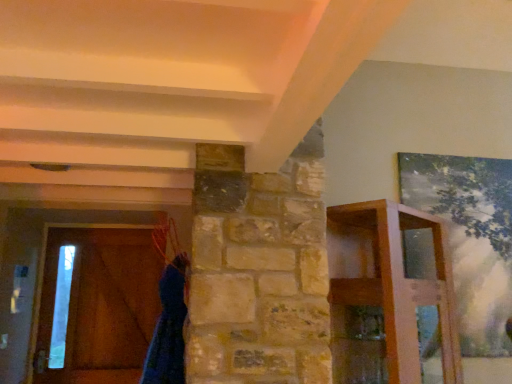
Question: Is wooden shelf at right positioned in front of brown wooden barn door at left?

Choices:
 (A) yes
 (B) no

Answer: (A)

Question: Considering the relative sizes of wooden shelf at right and brown wooden barn door at left in the image provided, is wooden shelf at right thinner than brown wooden barn door at left?

Choices:
 (A) no
 (B) yes

Answer: (A)

Question: Is wooden shelf at right further to the viewer compared to brown wooden barn door at left?

Choices:
 (A) yes
 (B) no

Answer: (B)

Question: Is wooden shelf at right far away from brown wooden barn door at left?

Choices:
 (A) no
 (B) yes

Answer: (B)

Question: Is wooden shelf at right facing away from brown wooden barn door at left?

Choices:
 (A) no
 (B) yes

Answer: (B)

Question: Is brown wooden barn door at left a part of wooden shelf at right?

Choices:
 (A) no
 (B) yes

Answer: (A)

Question: Is blue fuzzy robe at lower left shorter than brown wooden barn door at left?

Choices:
 (A) yes
 (B) no

Answer: (A)

Question: Is blue fuzzy robe at lower left positioned before brown wooden barn door at left?

Choices:
 (A) yes
 (B) no

Answer: (A)

Question: Is blue fuzzy robe at lower left positioned far away from brown wooden barn door at left?

Choices:
 (A) yes
 (B) no

Answer: (A)

Question: From a real-world perspective, is blue fuzzy robe at lower left located beneath brown wooden barn door at left?

Choices:
 (A) yes
 (B) no

Answer: (A)

Question: Is brown wooden barn door at left completely or partially inside blue fuzzy robe at lower left?

Choices:
 (A) yes
 (B) no

Answer: (B)

Question: From the image's perspective, is blue fuzzy robe at lower left above brown wooden barn door at left?

Choices:
 (A) no
 (B) yes

Answer: (B)

Question: From the image's perspective, would you say brown wooden barn door at left is positioned over blue fuzzy robe at lower left?

Choices:
 (A) yes
 (B) no

Answer: (B)